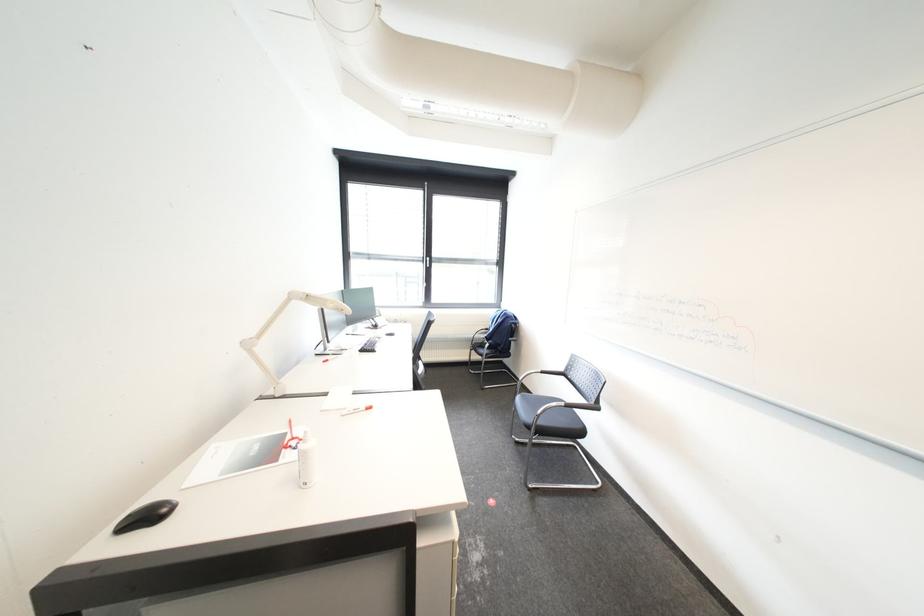
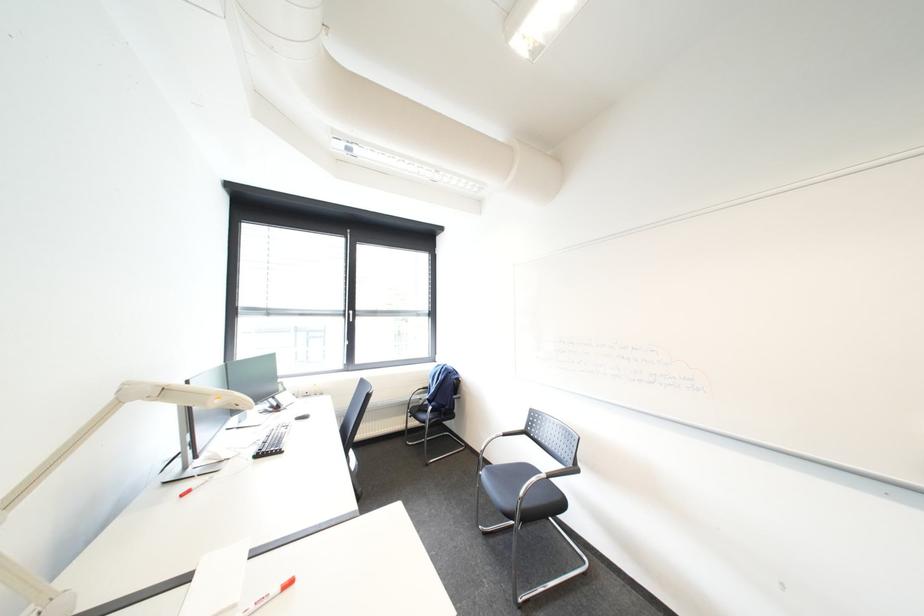
Question: The camera is either moving clockwise (left) or counter-clockwise (right) around the object. The first image is from the beginning of the video and the second image is from the end. Is the camera moving left or right when shooting the video?

Choices:
 (A) Left
 (B) Right

Answer: (A)